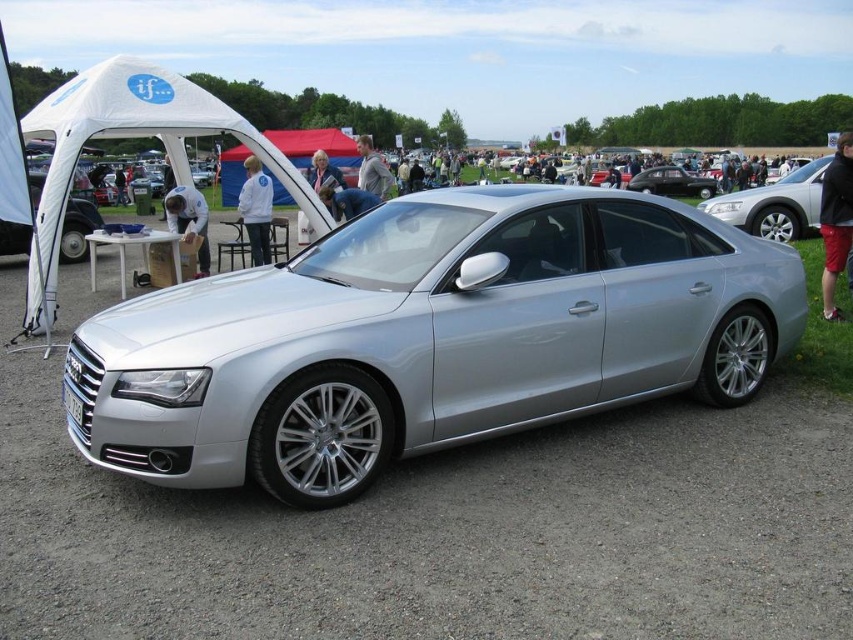
You are at a car exhibition and see two tents. One is the white fabric tent at upper left and the other is the white fabric tent at center. From your perspective, which tent is positioned to the right of the other?

The white fabric tent at upper left is to the right of the white fabric tent at center.

You are a photographer at the car exhibition and want to take a photo of the silver metallic car at center without any obstructions. Is the white fabric tent at center blocking the sunlight from reaching the car?

The silver metallic car at center is positioned under the white fabric tent at center, so the tent is blocking some sunlight from reaching the car. To capture the car without obstructions, you might need to move it out from under the tent or adjust the angle to avoid the tent structure.

You are a photographer standing at the silver metallic car at center and want to take a photo of the white fabric tent at center. Given that your camera has a maximum focus range of 10 meters, will you be able to capture the tent clearly?

The distance between the silver metallic car at center and the white fabric tent at center is 9.23 meters, which is within the camera maximum focus range of 10 meters. Therefore, you can capture the tent clearly.